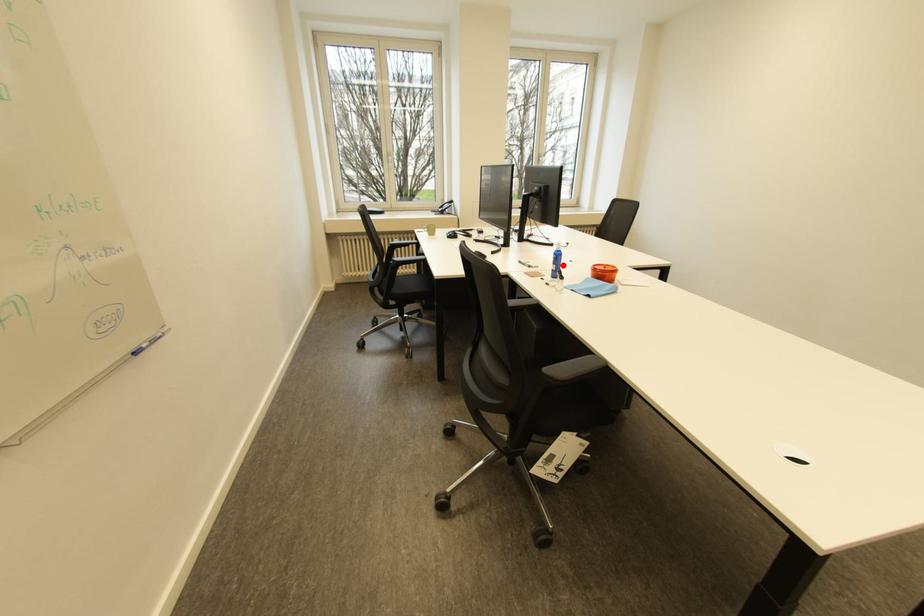
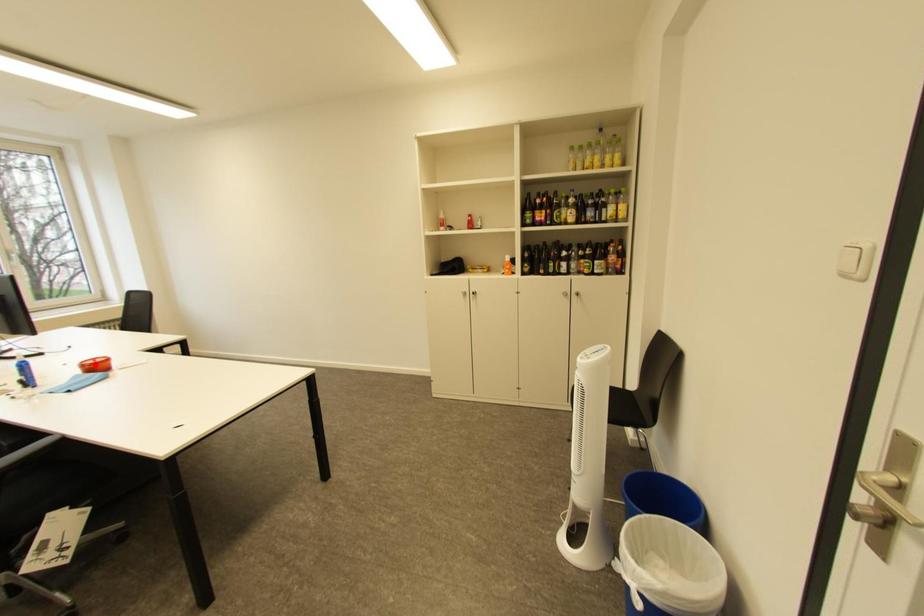
I am providing you with two images of the same scene from different viewpoints. A red point is marked on the first image and another point is marked on the second image. Is the red point in image1 aligned with the point shown in image2?

No